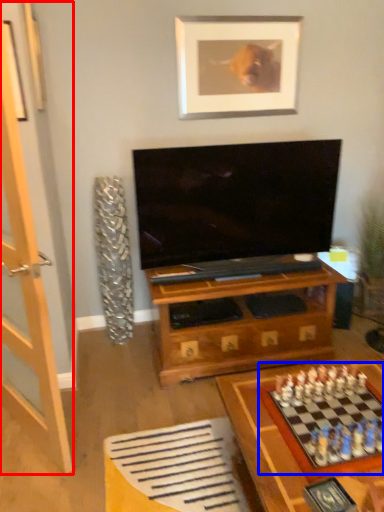
Question: Among these objects, which one is nearest to the camera, glass door (highlighted by a red box) or board game (highlighted by a blue box)?

Choices:
 (A) glass door
 (B) board game

Answer: (A)